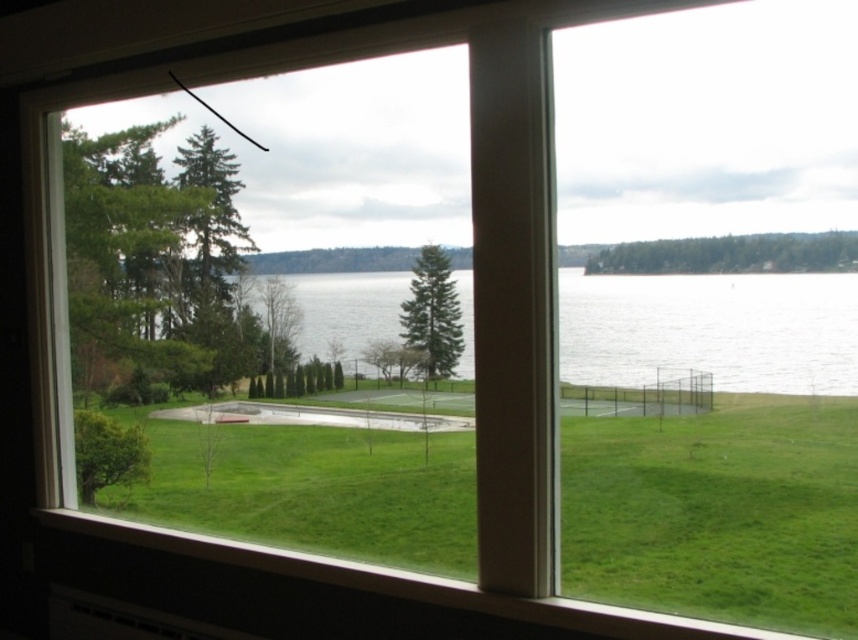
You are designing a layout for a new park and need to decide where to place a small playground. The playground requires a flat area larger than the green grassy at lower left. Based on the scene, can the clear water at center accommodate the playground?

The clear water at center occupies more space than the green grassy at lower left, so it could potentially accommodate the playground if the water were drained or the area is suitable for construction. However, the scene depicts water there, so this would require altering the existing landscape.

You are standing at the center of the paved court and want to walk towards the green grassy area marked by point (717,509). Which direction should you head?

You should head towards the lower left direction to reach the green grassy area marked by point (717,509).

You are a landscape architect designing a new garden. You need to place a small statue that requires a flat, elevated area. Based on the scene, which area between the green grassy at lower left and the clear water at center would be suitable for placing the statue?

The green grassy at lower left has a lesser height compared to clear water at center, so the clear water at center is higher. Since the statue needs a flat elevated area, the clear water at center would be suitable as it is higher ground.